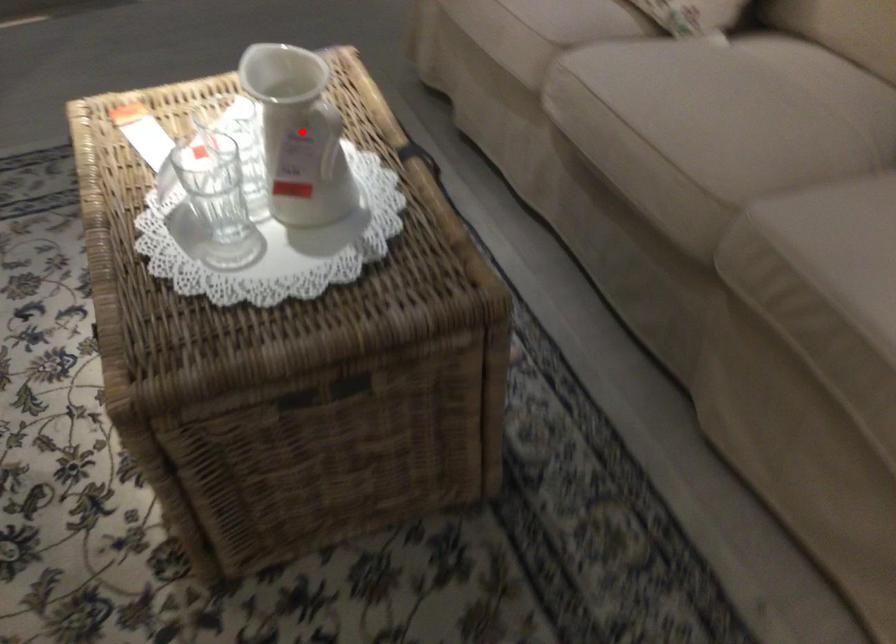
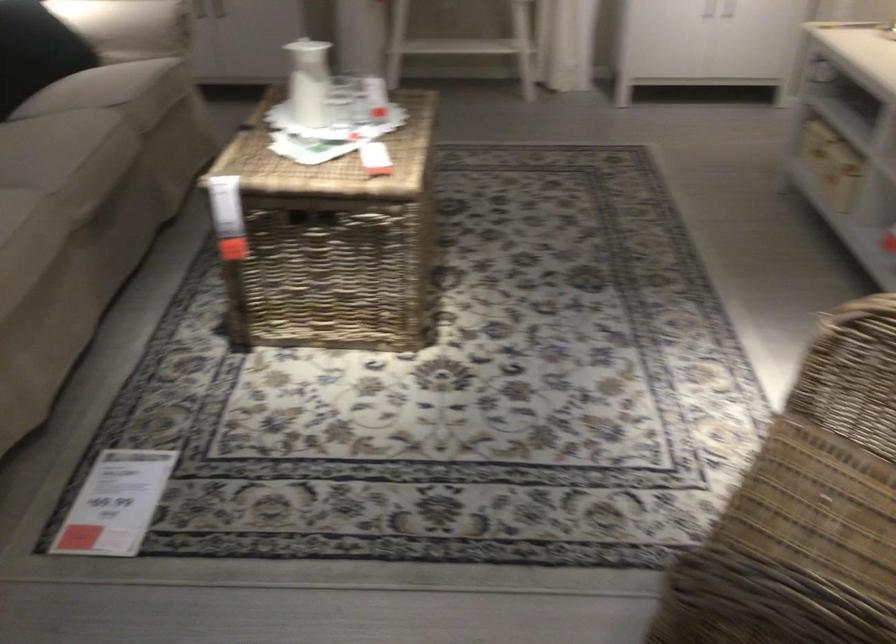
Where in the second image is the point corresponding to the highlighted location from the first image?

(308, 82)